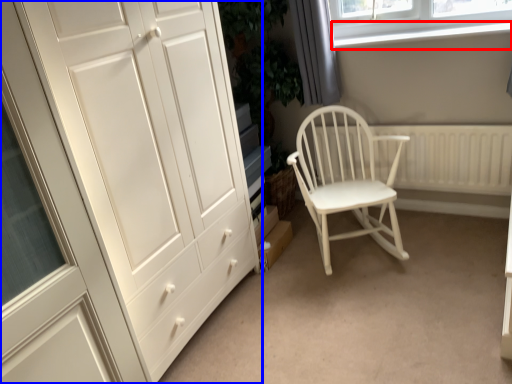
Question: Which object appears closest to the camera in this image, window sill (highlighted by a red box) or cupboard (highlighted by a blue box)?

Choices:
 (A) window sill
 (B) cupboard

Answer: (B)